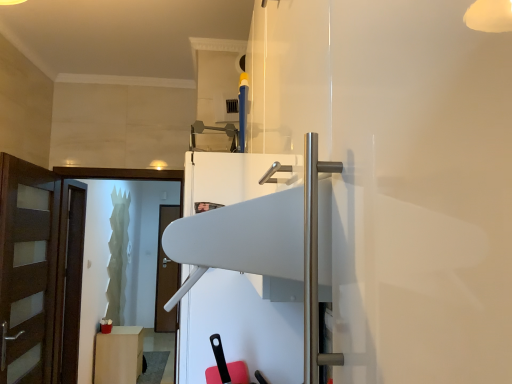
Image resolution: width=512 pixels, height=384 pixels. What do you see at coordinates (268, 245) in the screenshot?
I see `white glossy fridge at center` at bounding box center [268, 245].

Locate an element on the screen. white glossy fridge at center is located at coordinates (268, 245).

How many degrees apart are the facing directions of white glossy fridge at center and transparent glass screen door at left?

89.6 degrees.

From a real-world perspective, who is located lower, white glossy fridge at center or transparent glass screen door at left?

From a 3D spatial view, transparent glass screen door at left is below.

From the image's perspective, who appears lower, white glossy fridge at center or transparent glass screen door at left?

transparent glass screen door at left is shown below in the image.

Can you confirm if matte white cabinet at lower left is bigger than brown wooden door at left?

Actually, matte white cabinet at lower left might be smaller than brown wooden door at left.

From a real-world perspective, is matte white cabinet at lower left physically located above or below brown wooden door at left?

From a real-world perspective, matte white cabinet at lower left is physically below brown wooden door at left.

Is matte white cabinet at lower left oriented towards brown wooden door at left?

No, matte white cabinet at lower left is not aimed at brown wooden door at left.

Is matte white cabinet at lower left in front of or behind brown wooden door at left in the image?

matte white cabinet at lower left is positioned farther from the viewer than brown wooden door at left.

Is transparent glass screen door at left oriented away from white glossy fridge at center?

transparent glass screen door at left does not have its back to white glossy fridge at center.

Considering the positions of points (167, 178) and (210, 263), is point (167, 178) farther from camera compared to point (210, 263)?

Yes, it is.

Is transparent glass screen door at left bigger than white glossy fridge at center?

No, transparent glass screen door at left is not bigger than white glossy fridge at center.

The height and width of the screenshot is (384, 512). What are the coordinates of `screen door below the white glossy fridge at center (from the image's perspective)` in the screenshot? It's located at (124, 176).

Is point (127, 343) closer to camera compared to point (60, 174)?

No.

Does matte white cabinet at lower left have a greater height compared to transparent glass screen door at left?

No, matte white cabinet at lower left is not taller than transparent glass screen door at left.

Could you tell me if matte white cabinet at lower left is turned towards transparent glass screen door at left?

No, matte white cabinet at lower left is not turned towards transparent glass screen door at left.

Is matte white cabinet at lower left bigger than transparent glass screen door at left?

No, matte white cabinet at lower left is not bigger than transparent glass screen door at left.

Which is more to the left, brown wooden door at left or transparent glass screen door at left?

From the viewer's perspective, brown wooden door at left appears more on the left side.

Considering the positions of points (77, 300) and (133, 171), is point (77, 300) closer to camera compared to point (133, 171)?

No.

From the image's perspective, which one is positioned higher, brown wooden door at left or transparent glass screen door at left?

transparent glass screen door at left is shown above in the image.

Between brown wooden door at left and transparent glass screen door at left, which one is positioned behind?

brown wooden door at left.

Is white glossy fridge at center situated inside brown wooden door at left or outside?

white glossy fridge at center is spatially situated outside brown wooden door at left.

Is white glossy fridge at center taller than brown wooden door at left?

Incorrect, the height of white glossy fridge at center is not larger of that of brown wooden door at left.

Measure the distance from white glossy fridge at center to brown wooden door at left.

white glossy fridge at center is 7.13 feet away from brown wooden door at left.

Is transparent glass screen door at left facing towards brown wooden door at left?

No, transparent glass screen door at left is not facing towards brown wooden door at left.

Which is closer to the camera, (74, 168) or (7, 155)?

Point (74, 168) is positioned farther from the camera compared to point (7, 155).

Can we say transparent glass screen door at left lies outside brown wooden door at left?

transparent glass screen door at left is positioned outside brown wooden door at left.

Who is shorter, transparent glass screen door at left or brown wooden door at left?

transparent glass screen door at left is shorter.

Image resolution: width=512 pixels, height=384 pixels. Find the location of `fridge above the transparent glass screen door at left (from a real-world perspective)`. fridge above the transparent glass screen door at left (from a real-world perspective) is located at coordinates [x=268, y=245].

This screenshot has height=384, width=512. Find the location of `cabinetry behind the brown wooden door at left`. cabinetry behind the brown wooden door at left is located at coordinates (119, 355).

Based on the photo, when comparing their distances from white glossy fridge at center, does transparent glass screen door at left or brown wooden door at left seem further?

transparent glass screen door at left is further to white glossy fridge at center.

From the image, which object appears to be farther from brown wooden door at left, white glossy fridge at center or transparent glass screen door at left?

white glossy fridge at center is further to brown wooden door at left.

Looking at the image, which one is located closer to matte white cabinet at lower left, brown wooden door at left or white glossy fridge at center?

brown wooden door at left.

Considering their positions, is brown wooden door at left positioned further to transparent glass screen door at left than white glossy fridge at center?

white glossy fridge at center.

Considering their positions, is brown wooden door at left positioned further to white glossy fridge at center than transparent glass screen door at left?

transparent glass screen door at left is further to white glossy fridge at center.

When comparing their distances from brown wooden door at left, does transparent glass screen door at left or matte white cabinet at lower left seem further?

Based on the image, matte white cabinet at lower left appears to be further to brown wooden door at left.

Which object lies further to the anchor point matte white cabinet at lower left, transparent glass screen door at left or brown wooden door at left?

transparent glass screen door at left is positioned further to the anchor matte white cabinet at lower left.

When comparing their distances from matte white cabinet at lower left, does white glossy fridge at center or transparent glass screen door at left seem closer?

transparent glass screen door at left is closer to matte white cabinet at lower left.

The image size is (512, 384). Identify the location of screen door between white glossy fridge at center and matte white cabinet at lower left in the front-back direction. (124, 176).

The height and width of the screenshot is (384, 512). I want to click on screen door between white glossy fridge at center and brown wooden door at left from front to back, so click(124, 176).

You are a GUI agent. You are given a task and a screenshot of the screen. Output one action in this format:
    pyautogui.click(x=<x>, y=<y>)
    Task: Click on the door positioned between white glossy fridge at center and matte white cabinet at lower left from near to far
    The image size is (512, 384).
    Given the screenshot: What is the action you would take?
    pyautogui.click(x=39, y=273)

Where is `door located between transparent glass screen door at left and matte white cabinet at lower left in the depth direction`? This screenshot has height=384, width=512. door located between transparent glass screen door at left and matte white cabinet at lower left in the depth direction is located at coordinates (39, 273).